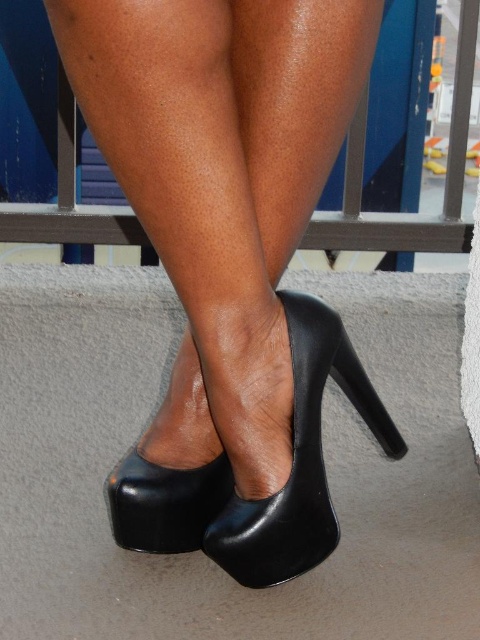
Question: In this image, where is black leather high heels at center located relative to metallic gray rail at upper center?

Choices:
 (A) above
 (B) below

Answer: (B)

Question: Considering the relative positions of black leather high heels at center and black leather high-heeled shoe at lower center in the image provided, where is black leather high heels at center located with respect to black leather high-heeled shoe at lower center?

Choices:
 (A) right
 (B) left

Answer: (A)

Question: Among these points, which one is nearest to the camera?

Choices:
 (A) (421, 250)
 (B) (144, 113)

Answer: (B)

Question: Which point appears closest to the camera in this image?

Choices:
 (A) (119, 492)
 (B) (447, 161)

Answer: (A)

Question: Is black leather high heels at center further to camera compared to black leather high-heeled shoe at lower center?

Choices:
 (A) no
 (B) yes

Answer: (A)

Question: Which object is farther from the camera taking this photo?

Choices:
 (A) black leather high-heeled shoe at lower center
 (B) black leather high-heeled shoe at center
 (C) black leather high heels at center

Answer: (A)